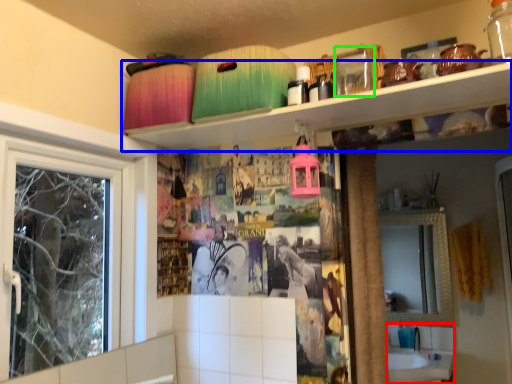
Question: Considering the real-world distances, which object is farthest from sink (highlighted by a red box)? shelf (highlighted by a blue box) or glass jar (highlighted by a green box)?

Choices:
 (A) shelf
 (B) glass jar

Answer: (B)